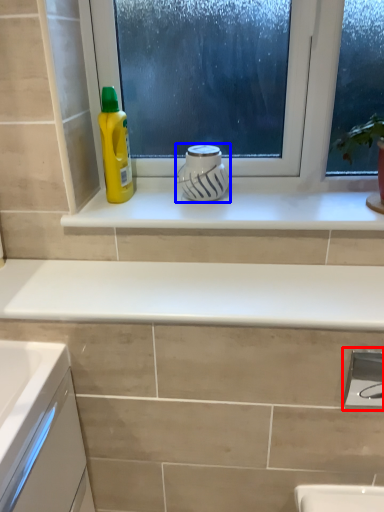
Question: Among these objects, which one is nearest to the camera, faucet (highlighted by a red box) or appliance (highlighted by a blue box)?

Choices:
 (A) faucet
 (B) appliance

Answer: (A)